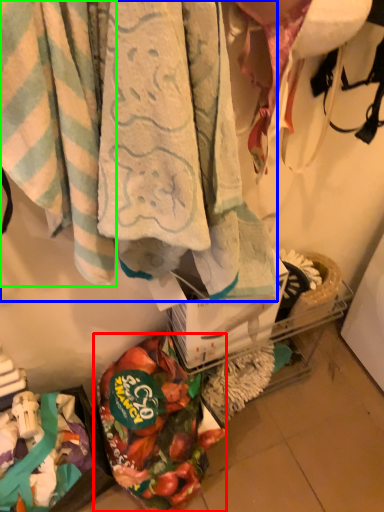
Question: Considering the real-world distances, which object is closest to food (highlighted by a red box)? towel (highlighted by a blue box) or towel (highlighted by a green box).

Choices:
 (A) towel
 (B) towel

Answer: (A)